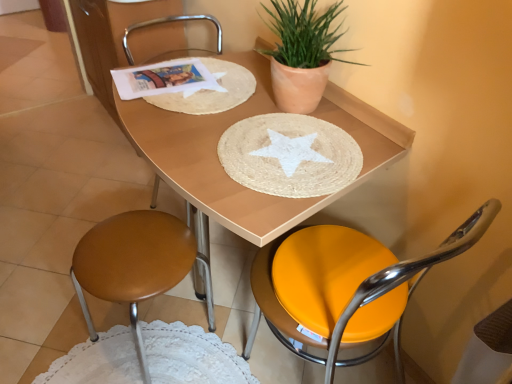
Question: Would you say metallic silver chair at center, the second chair in the right-to-left sequence, is to the left or to the right of terracotta clay pot at upper right in the picture?

Choices:
 (A) right
 (B) left

Answer: (B)

Question: From their relative heights in the image, would you say metallic silver chair at center, the second chair in the right-to-left sequence, is taller or shorter than terracotta clay pot at upper right?

Choices:
 (A) short
 (B) tall

Answer: (B)

Question: Which of these objects is positioned closest to the natural fiber placemat at center, the 2th paper plate when ordered from top to bottom?

Choices:
 (A) orange leather chair at center, placed as the third chair when sorted from left to right
 (B) wooden placemat at center
 (C) terracotta clay pot at upper right
 (D) metallic silver chair at center, the second chair in the right-to-left sequence
 (E) wooden seat at lower left, the first chair positioned from the left

Answer: (B)

Question: Which of these objects is positioned farthest from the natural fiber placemat at center, the first paper plate positioned from the bottom?

Choices:
 (A) white woven placemat at upper left, the second paper plate when ordered from bottom to top
 (B) wooden placemat at center
 (C) white paper at upper left
 (D) wooden seat at lower left, the first chair positioned from the left
 (E) metallic silver chair at center, marked as the 2th chair in a left-to-right arrangement

Answer: (E)